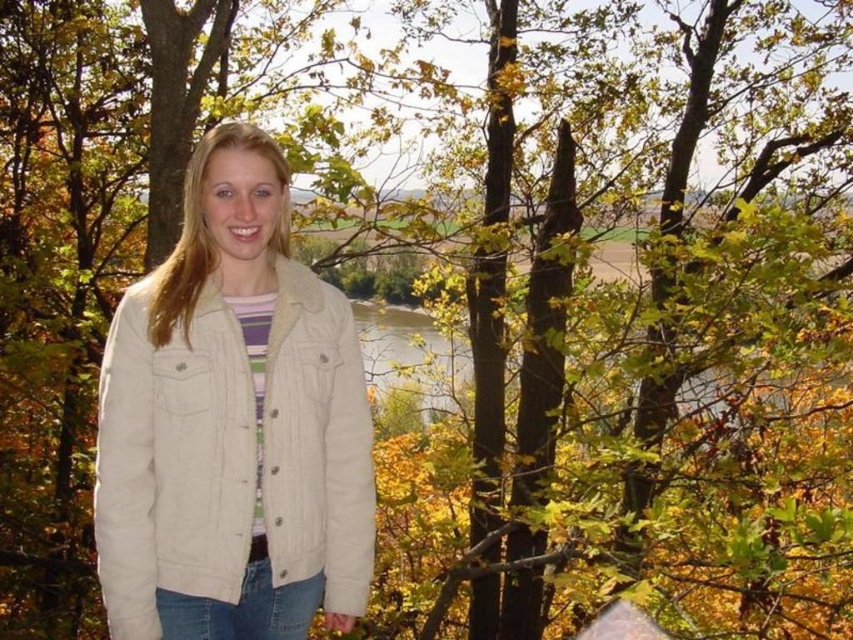
Question: Is beige corduroy jacket at center to the right of greenish-brown water at center from the viewer's perspective?

Choices:
 (A) yes
 (B) no

Answer: (B)

Question: Is beige corduroy jacket at center further to camera compared to greenish-brown water at center?

Choices:
 (A) yes
 (B) no

Answer: (B)

Question: Is beige corduroy jacket at center wider than greenish-brown water at center?

Choices:
 (A) no
 (B) yes

Answer: (B)

Question: Among these points, which one is nearest to the camera?

Choices:
 (A) (242, 577)
 (B) (703, 390)

Answer: (A)